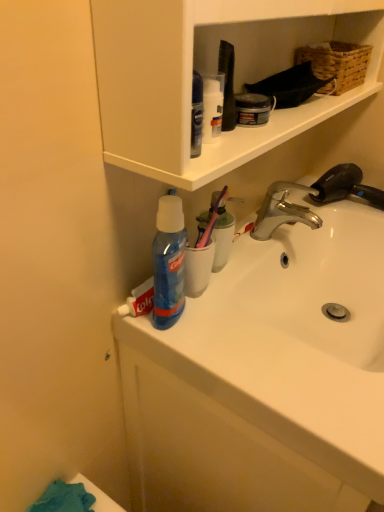
Identify the location of free spot below silver metallic faucet at upper right (from a real-world perspective). The width and height of the screenshot is (384, 512). (357, 207).